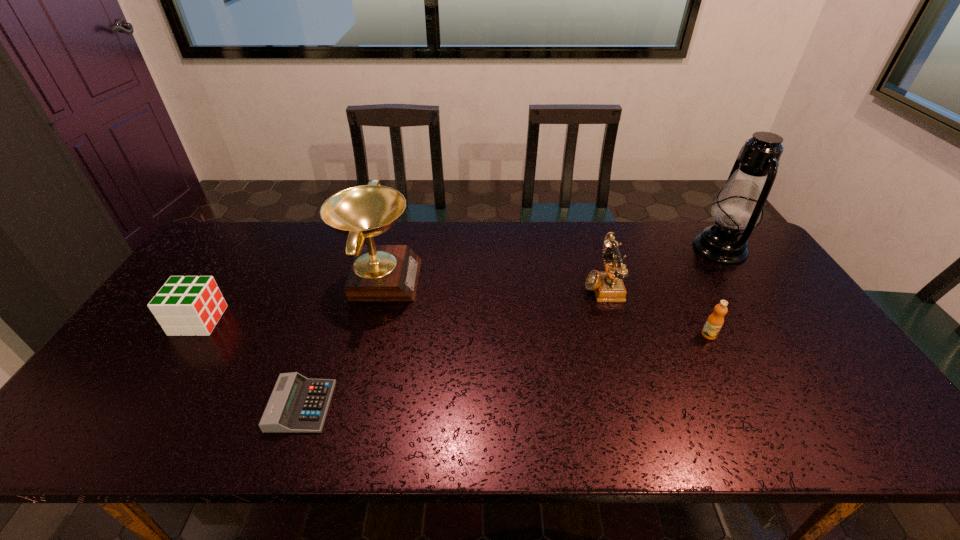
Find the location of a particular element. The image size is (960, 540). vacant space that's between the orange juice and the cube is located at coordinates (454, 328).

This screenshot has height=540, width=960. I want to click on free space between the leftmost object and the award, so click(289, 300).

The width and height of the screenshot is (960, 540). I want to click on free space between the fifth shortest object and the fourth shortest object, so click(491, 281).

Locate an element on the screen. The height and width of the screenshot is (540, 960). vacant area that lies between the cube and the fourth object from left to right is located at coordinates (400, 302).

The width and height of the screenshot is (960, 540). In order to click on free space between the cube and the nearest object in this screenshot , I will do `click(250, 363)`.

Find the location of `free space that is in between the second object from right to left and the rightmost object`. free space that is in between the second object from right to left and the rightmost object is located at coordinates (714, 292).

The image size is (960, 540). I want to click on empty location between the rightmost object and the nearest object, so click(x=511, y=327).

In order to click on empty space that is in between the award and the tallest object in this screenshot , I will do `click(549, 264)`.

Find the location of `object that stands as the third closest to the leftmost object`. object that stands as the third closest to the leftmost object is located at coordinates (608, 286).

You are a GUI agent. You are given a task and a screenshot of the screen. Output one action in this format:
    pyautogui.click(x=<x>, y=<y>)
    Task: Click on the object that ranks as the fifth closest to the cube
    The height and width of the screenshot is (540, 960).
    Given the screenshot: What is the action you would take?
    pyautogui.click(x=739, y=204)